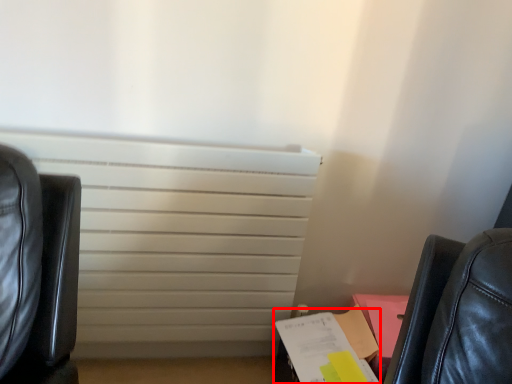
Question: Considering the relative positions of paperback book (annotated by the red box) and radiator in the image provided, where is paperback book (annotated by the red box) located with respect to the staircase?

Choices:
 (A) right
 (B) left

Answer: (A)